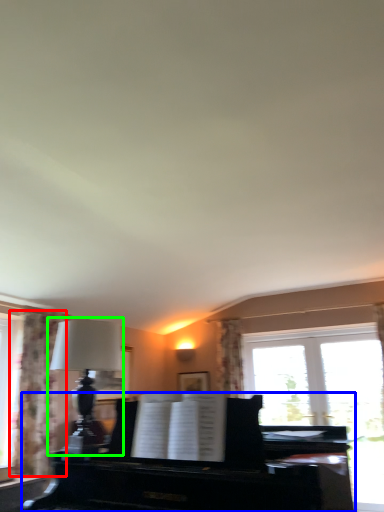
Question: Based on their relative distances, which object is nearer to curtain (highlighted by a red box)? Choose from piano (highlighted by a blue box) and table lamp (highlighted by a green box).

Choices:
 (A) piano
 (B) table lamp

Answer: (B)